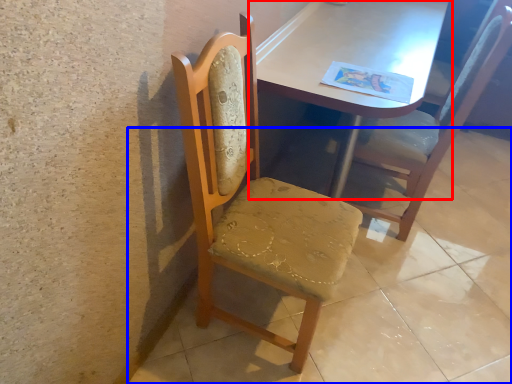
Question: Which point is further to the camera, table (highlighted by a red box) or concrete (highlighted by a blue box)?

Choices:
 (A) table
 (B) concrete

Answer: (A)